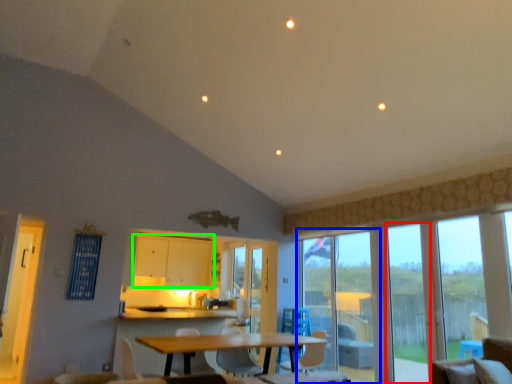
Question: Which is farther away from window (highlighted by a red box)? glass door (highlighted by a blue box) or cabinetry (highlighted by a green box)?

Choices:
 (A) glass door
 (B) cabinetry

Answer: (B)